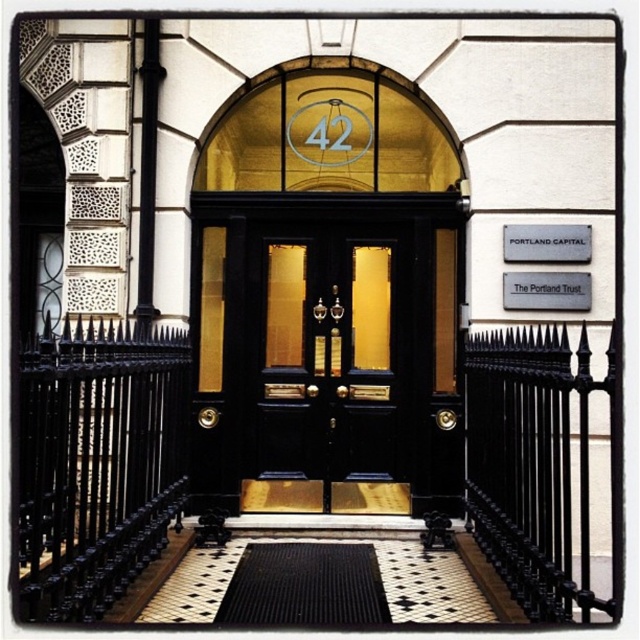
Question: Can you confirm if black polished wood door at center is positioned above black rubber doormat at center?

Choices:
 (A) no
 (B) yes

Answer: (B)

Question: Which of the following is the closest to the observer?

Choices:
 (A) (541, 241)
 (B) (324, 241)
 (C) (428, 355)

Answer: (A)

Question: Is matte black door at center wider than metallic gray sign at upper right?

Choices:
 (A) yes
 (B) no

Answer: (A)

Question: Can you confirm if black polished wood door at center is positioned to the left of black rubber doormat at center?

Choices:
 (A) no
 (B) yes

Answer: (A)

Question: Which point is closer to the camera?

Choices:
 (A) black rubber doormat at center
 (B) black polished wood door at center
 (C) metallic gray sign at upper right
 (D) matte black door at center

Answer: (A)

Question: Which of the following is the farthest from the observer?

Choices:
 (A) black polished wood door at center
 (B) matte black door at center
 (C) black rubber doormat at center

Answer: (A)